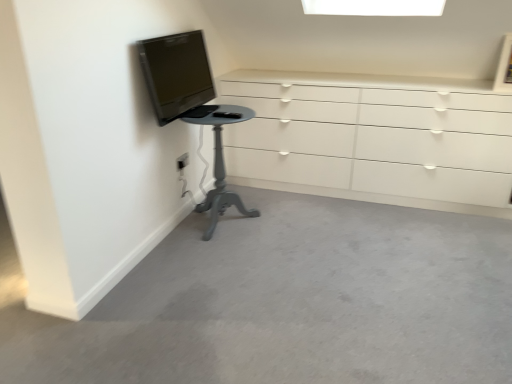
Question: Is white plastic electric outlet at lower left completely or partially outside of matte gray pedestal table at lower left?

Choices:
 (A) yes
 (B) no

Answer: (A)

Question: From the image's perspective, is white plastic electric outlet at lower left beneath matte gray pedestal table at lower left?

Choices:
 (A) no
 (B) yes

Answer: (A)

Question: Considering the relative sizes of white plastic electric outlet at lower left and matte gray pedestal table at lower left in the image provided, is white plastic electric outlet at lower left taller than matte gray pedestal table at lower left?

Choices:
 (A) no
 (B) yes

Answer: (A)

Question: From the image's perspective, does white plastic electric outlet at lower left appear higher than matte gray pedestal table at lower left?

Choices:
 (A) no
 (B) yes

Answer: (B)

Question: Does white plastic electric outlet at lower left have a lesser width compared to matte gray pedestal table at lower left?

Choices:
 (A) yes
 (B) no

Answer: (A)

Question: Is white glossy chest of drawers at upper right to the left or to the right of white plastic electric outlet at lower left in the image?

Choices:
 (A) left
 (B) right

Answer: (B)

Question: From a real-world perspective, relative to white plastic electric outlet at lower left, is white glossy chest of drawers at upper right vertically above or below?

Choices:
 (A) below
 (B) above

Answer: (B)

Question: Based on their sizes in the image, would you say white glossy chest of drawers at upper right is bigger or smaller than white plastic electric outlet at lower left?

Choices:
 (A) big
 (B) small

Answer: (A)

Question: Looking at their shapes, would you say white glossy chest of drawers at upper right is wider or thinner than white plastic electric outlet at lower left?

Choices:
 (A) thin
 (B) wide

Answer: (B)

Question: Considering the positions of point (412, 205) and point (224, 173), is point (412, 205) closer or farther from the camera than point (224, 173)?

Choices:
 (A) closer
 (B) farther

Answer: (A)

Question: From the image's perspective, is white glossy chest of drawers at upper right positioned above or below matte gray pedestal table at lower left?

Choices:
 (A) below
 (B) above

Answer: (B)

Question: Considering their positions, is white glossy chest of drawers at upper right located in front of or behind matte gray pedestal table at lower left?

Choices:
 (A) front
 (B) behind

Answer: (B)

Question: Looking at their shapes, would you say white glossy chest of drawers at upper right is wider or thinner than matte gray pedestal table at lower left?

Choices:
 (A) wide
 (B) thin

Answer: (A)

Question: From a real-world perspective, relative to matte black tv at upper left, is white glossy chest of drawers at upper right vertically above or below?

Choices:
 (A) below
 (B) above

Answer: (A)

Question: Considering the relative positions of white glossy chest of drawers at upper right and matte black tv at upper left in the image provided, is white glossy chest of drawers at upper right to the left or to the right of matte black tv at upper left?

Choices:
 (A) right
 (B) left

Answer: (A)